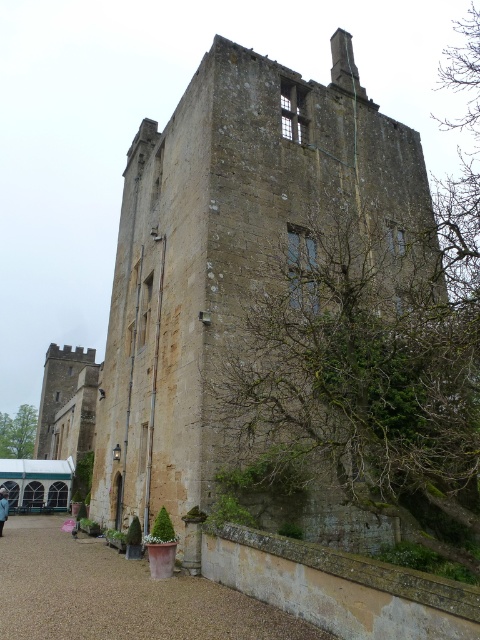
You are a tour guide describing the historic site to visitors. You mention both the brown stone castle at center and the brown gravel driveway at lower center. Which of these two features is larger in size?

The brown stone castle at center is bigger than the brown gravel driveway at lower center, so the castle is the larger feature.

You are standing in a field and see the brown stone castle at center in the distance. If you want to take a photo of it with your smartphone, which has a maximum zoom range of 10 meters, will you be able to capture the entire structure clearly without moving closer?

The brown stone castle at center is 41.10 meters away from camera, which is beyond the smartphone camera maximum zoom range of 10 meters. Therefore, you cannot capture the entire structure clearly without moving closer.

You are a visitor approaching the brown stone castle at center and the brown gravel driveway at lower center. Which object is closer to you as you arrive?

The brown gravel driveway at lower center is behind the brown stone castle at center, so the brown stone castle at center is closer to you as you arrive.